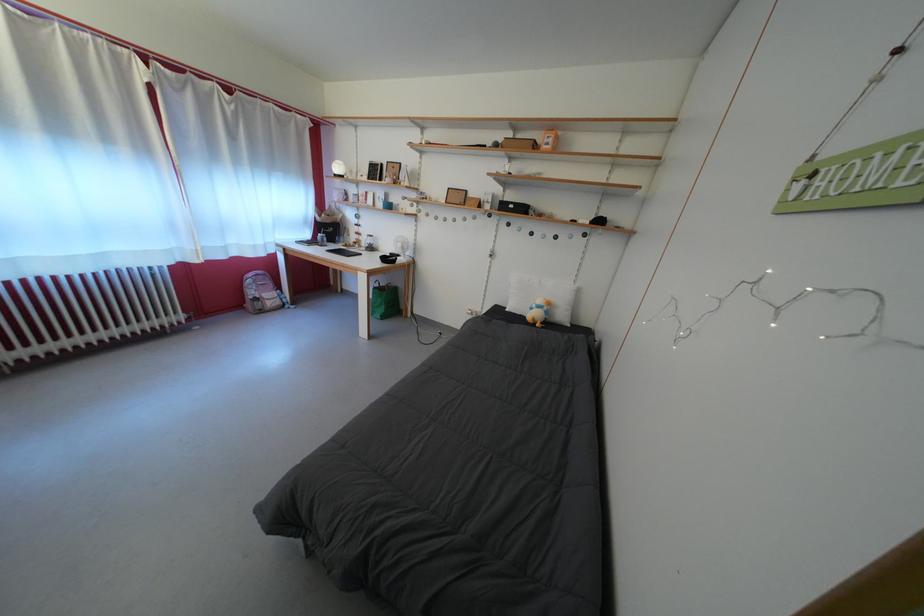
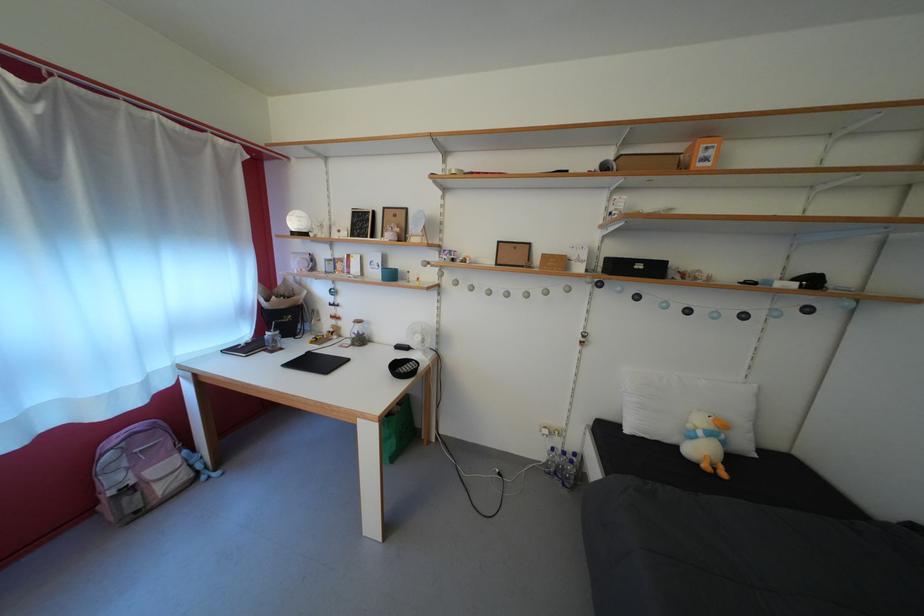
Find the pixel in the second image that matches the point at 373,246 in the first image.

(358, 334)